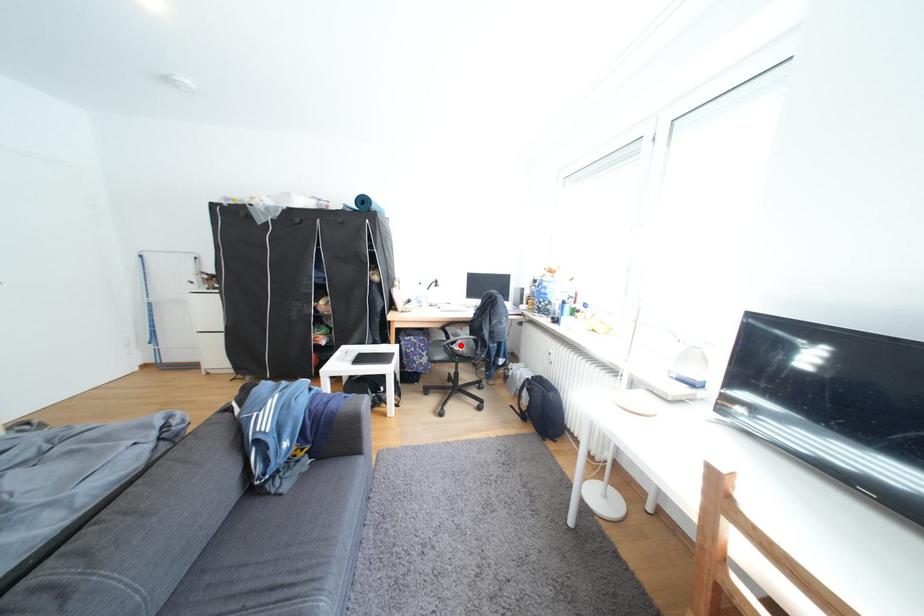
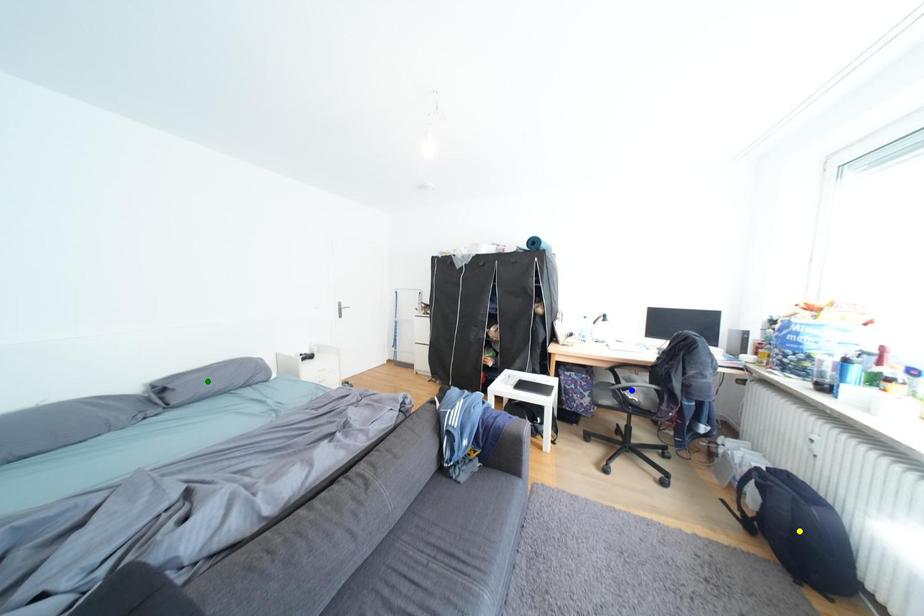
Question: I am providing you with two images of the same scene from different viewpoints. A red point is marked on the first image. You are given multiple points on the second image. In image 2, which mark is for the same physical point as the one in image 1?

Choices:
 (A) yellow point
 (B) blue point
 (C) green point

Answer: (B)